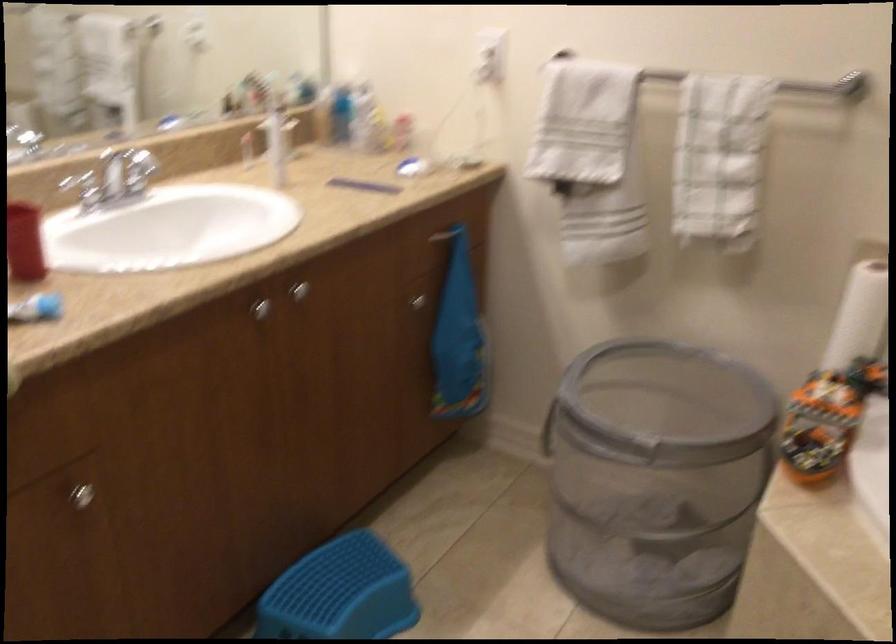
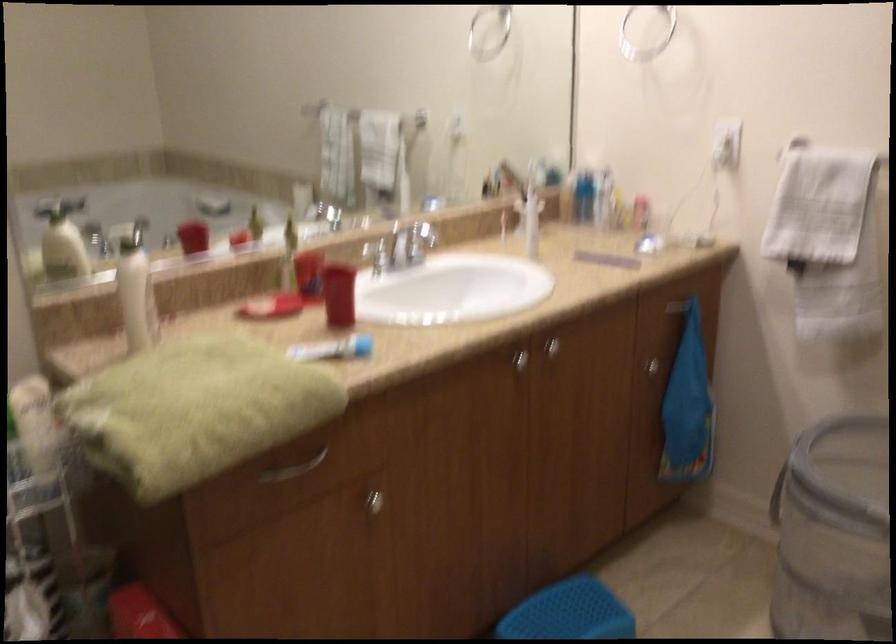
Find the pixel in the second image that matches point 300,294 in the first image.

(552, 348)